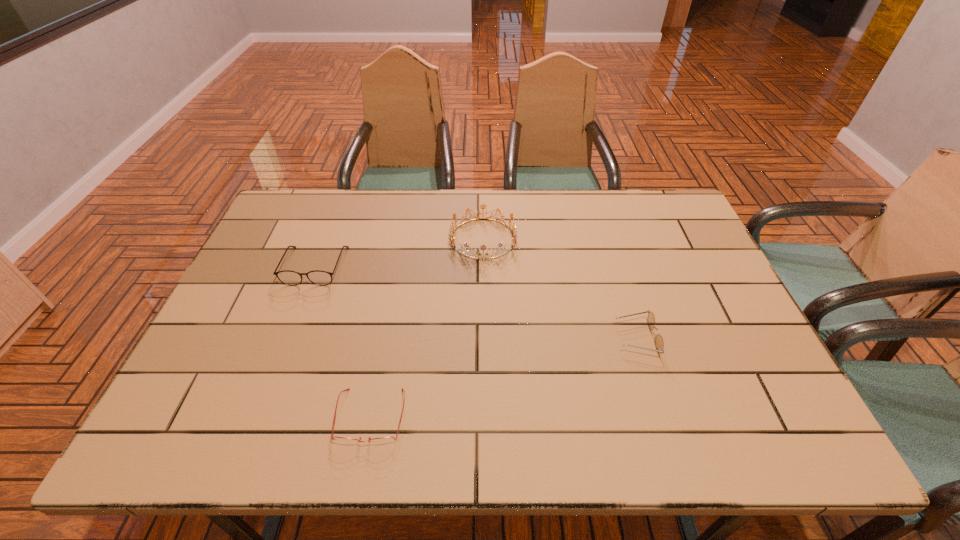
Identify the location of vacant region located 0.120m on the front-facing side of the rightmost object. The width and height of the screenshot is (960, 540). (569, 338).

Locate an element on the screen. blank area located 0.110m on the front-facing side of the rightmost object is located at coordinates pos(573,338).

You are a GUI agent. You are given a task and a screenshot of the screen. Output one action in this format:
    pyautogui.click(x=<x>, y=<y>)
    Task: Click on the vacant space situated on the front-facing side of the rightmost object
    
    Given the screenshot: What is the action you would take?
    pyautogui.click(x=474, y=338)

Find the location of a particular element. This screenshot has height=540, width=960. object present at the far edge is located at coordinates (514, 232).

This screenshot has height=540, width=960. Identify the location of object that is positioned at the near edge. (384, 440).

Identify the location of object at the left edge. Image resolution: width=960 pixels, height=540 pixels. (292, 278).

The image size is (960, 540). In the image, there is a desktop. In order to click on vacant space at the far edge in this screenshot , I will do `click(497, 202)`.

Where is `free spot at the near edge of the desktop`? The image size is (960, 540). free spot at the near edge of the desktop is located at coordinates (429, 428).

Locate an element on the screen. vacant space at the left edge is located at coordinates (302, 257).

Where is `vacant point at the right edge`? The width and height of the screenshot is (960, 540). vacant point at the right edge is located at coordinates tap(708, 256).